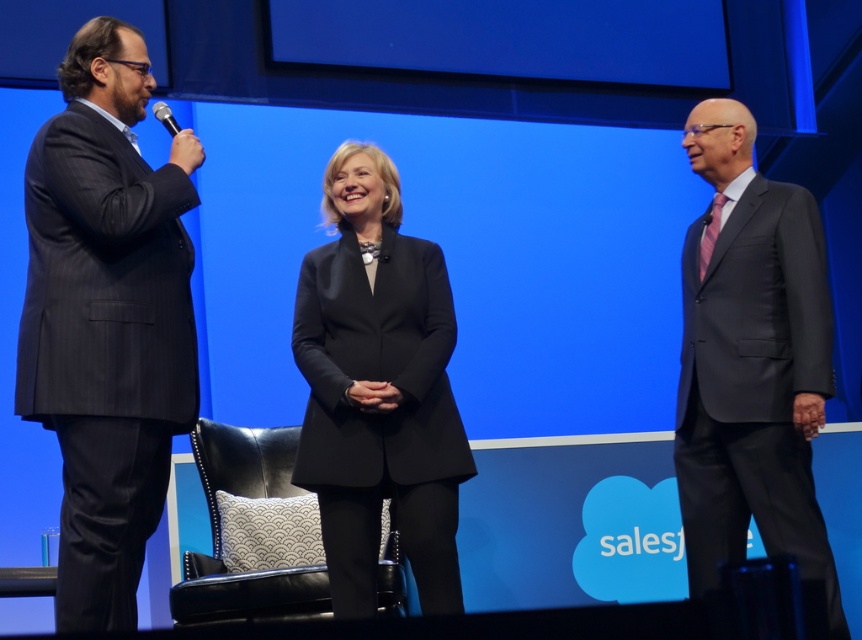
Question: Considering the real-world distances, which object is closest to the dark gray pinstripe suit at left?

Choices:
 (A) dark gray suit at right
 (B) black leather chair at center
 (C) black matte suit at center
 (D) metallic silver microphone at left

Answer: (D)

Question: Which object is farther from the camera taking this photo?

Choices:
 (A) black matte suit at center
 (B) dark gray suit at right

Answer: (A)

Question: Does dark gray suit at right come behind black matte suit at center?

Choices:
 (A) yes
 (B) no

Answer: (B)

Question: Is dark gray pinstripe suit at left to the left of black leather chair at center from the viewer's perspective?

Choices:
 (A) no
 (B) yes

Answer: (B)

Question: Can you confirm if dark gray pinstripe suit at left is positioned to the right of black leather chair at center?

Choices:
 (A) no
 (B) yes

Answer: (A)

Question: Among these points, which one is farthest from the camera?

Choices:
 (A) (48, 154)
 (B) (409, 538)
 (C) (166, 122)

Answer: (B)